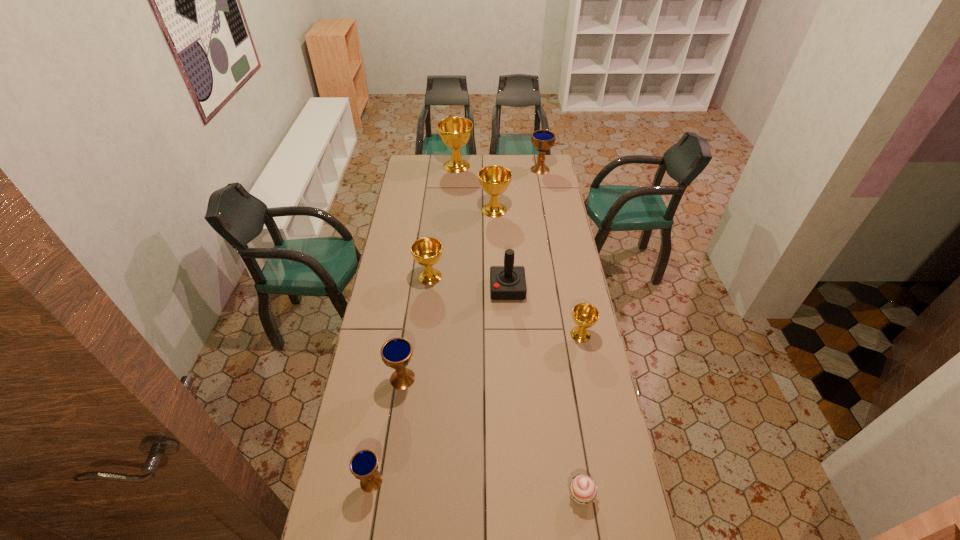
You are a GUI agent. You are given a task and a screenshot of the screen. Output one action in this format:
    pyautogui.click(x=<x>, y=<y>)
    Task: Click on the vacant space situated 0.190m on the base of the joystick
    The height and width of the screenshot is (540, 960).
    Given the screenshot: What is the action you would take?
    pyautogui.click(x=448, y=289)

The width and height of the screenshot is (960, 540). What are the coordinates of `vacant area located 0.260m on the base of the joystick` in the screenshot? It's located at (433, 289).

Locate an element on the screen. Image resolution: width=960 pixels, height=540 pixels. vacant area situated 0.150m on the base of the joystick is located at coordinates (457, 289).

This screenshot has width=960, height=540. Identify the location of blank space located 0.180m on the back of the second biggest blue chalice. (410, 329).

The image size is (960, 540). I want to click on vacant space situated 0.160m on the right of the third farthest gold chalice, so click(x=479, y=276).

I want to click on free space located 0.370m on the back of the nearest gold chalice, so click(x=566, y=264).

This screenshot has height=540, width=960. Identify the location of vacant area situated 0.360m on the right of the smallest blue chalice. (498, 481).

This screenshot has width=960, height=540. I want to click on free region located on the left of the shortest object, so click(547, 495).

Where is `cupcake positioned at the right edge`? cupcake positioned at the right edge is located at coordinates (583, 489).

You are a GUI agent. You are given a task and a screenshot of the screen. Output one action in this format:
    pyautogui.click(x=<x>, y=<y>)
    Task: Click on the object present at the far right corner
    This screenshot has width=960, height=540.
    Given the screenshot: What is the action you would take?
    pyautogui.click(x=543, y=140)